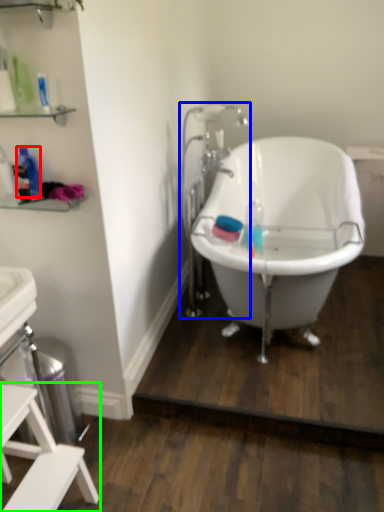
Question: Estimate the real-world distances between objects in this image. Which object is farther from bottle (highlighted by a red box), faucet (highlighted by a blue box) or furniture (highlighted by a green box)?

Choices:
 (A) faucet
 (B) furniture

Answer: (A)